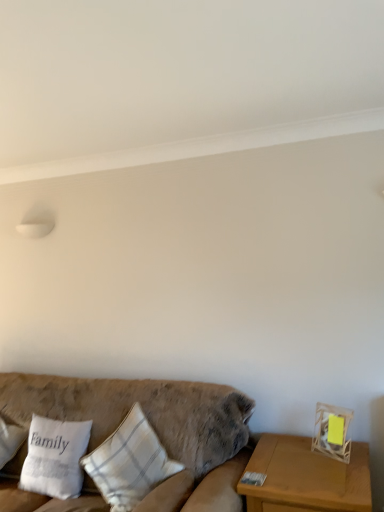
Question: From a real-world perspective, is white fabric pillow at lower left, the second pillow when ordered from right to left, positioned over white fabric pillow at left, which is the 1th pillow in left-to-right order, based on gravity?

Choices:
 (A) yes
 (B) no

Answer: (B)

Question: Considering the relative sizes of white fabric pillow at lower left, the second pillow when ordered from right to left, and white fabric pillow at left, which is the 1th pillow in left-to-right order, in the image provided, is white fabric pillow at lower left, the second pillow when ordered from right to left, taller than white fabric pillow at left, which is the 1th pillow in left-to-right order,?

Choices:
 (A) no
 (B) yes

Answer: (A)

Question: Could you tell me if white fabric pillow at lower left, placed as the 2th pillow when sorted from left to right, is facing white fabric pillow at left, which is the 1th pillow in left-to-right order?

Choices:
 (A) no
 (B) yes

Answer: (A)

Question: Are white fabric pillow at lower left, placed as the 2th pillow when sorted from left to right, and white fabric pillow at left, which is the 1th pillow in left-to-right order, far apart?

Choices:
 (A) yes
 (B) no

Answer: (B)

Question: Is white fabric pillow at lower left, placed as the 2th pillow when sorted from left to right, positioned before white fabric pillow at left, which is the 1th pillow in left-to-right order?

Choices:
 (A) yes
 (B) no

Answer: (A)

Question: Does point (31, 479) appear closer or farther from the camera than point (155, 401)?

Choices:
 (A) closer
 (B) farther

Answer: (A)

Question: Which is correct: white fabric pillow at lower left, placed as the 2th pillow when sorted from left to right, is inside velvet beige couch at lower left, or outside of it?

Choices:
 (A) inside
 (B) outside

Answer: (A)

Question: Visually, is white fabric pillow at lower left, the second pillow when ordered from right to left, positioned to the left or to the right of velvet beige couch at lower left?

Choices:
 (A) right
 (B) left

Answer: (B)

Question: From their relative heights in the image, would you say white fabric pillow at lower left, placed as the 2th pillow when sorted from left to right, is taller or shorter than velvet beige couch at lower left?

Choices:
 (A) short
 (B) tall

Answer: (A)

Question: Is white fabric pillow at left, which is the 1th pillow in left-to-right order, in front of or behind white fabric pillow at lower left, the second pillow when ordered from right to left, in the image?

Choices:
 (A) front
 (B) behind

Answer: (B)

Question: From the image's perspective, is white fabric pillow at left, which is the 1th pillow in left-to-right order, above or below white fabric pillow at lower left, placed as the 2th pillow when sorted from left to right?

Choices:
 (A) below
 (B) above

Answer: (B)

Question: Considering the relative positions of white fabric pillow at left, positioned as the 3th pillow in right-to-left order, and white fabric pillow at lower left, the second pillow when ordered from right to left, in the image provided, is white fabric pillow at left, positioned as the 3th pillow in right-to-left order, to the left or to the right of white fabric pillow at lower left, the second pillow when ordered from right to left,?

Choices:
 (A) right
 (B) left

Answer: (B)

Question: From a real-world perspective, is white fabric pillow at left, which is the 1th pillow in left-to-right order, physically located above or below white fabric pillow at lower left, placed as the 2th pillow when sorted from left to right?

Choices:
 (A) below
 (B) above

Answer: (B)

Question: Does point (127, 496) appear closer or farther from the camera than point (218, 430)?

Choices:
 (A) closer
 (B) farther

Answer: (A)

Question: From the image's perspective, relative to velvet beige couch at lower left, is white cotton pillow at left, the third pillow viewed from the left, above or below?

Choices:
 (A) above
 (B) below

Answer: (A)